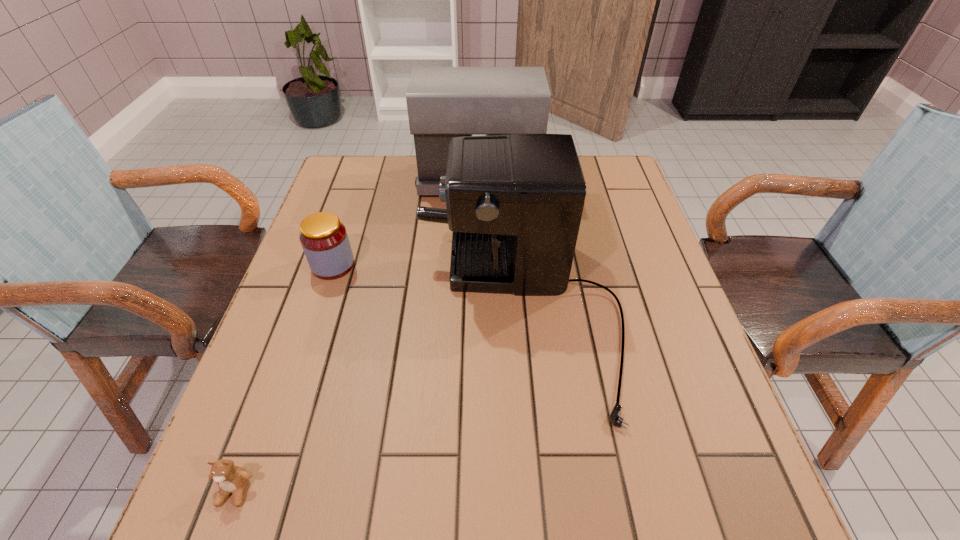
At what (x,y) coordinates should I click in order to perform the action: click on blank space that satisfies the following two spatial constraints: 1. on the carafe side of the farthest object; 2. on the front-facing side of the shortest object. Please return your answer as a coordinate pair (x, y). Image resolution: width=960 pixels, height=540 pixels. Looking at the image, I should click on (479, 490).

This screenshot has width=960, height=540. Find the location of `vacant space that satisfies the following two spatial constraints: 1. on the carafe side of the farthest object; 2. on the front side of the second shortest object`. vacant space that satisfies the following two spatial constraints: 1. on the carafe side of the farthest object; 2. on the front side of the second shortest object is located at coordinates (479, 265).

Find the location of a particular element. The height and width of the screenshot is (540, 960). vacant space that satisfies the following two spatial constraints: 1. on the front-facing side of the nearer coffee maker; 2. on the front-facing side of the nearest object is located at coordinates (532, 490).

Image resolution: width=960 pixels, height=540 pixels. Identify the location of vacant area that satisfies the following two spatial constraints: 1. on the front-facing side of the nearer coffee maker; 2. on the front-facing side of the nearest object. (532, 490).